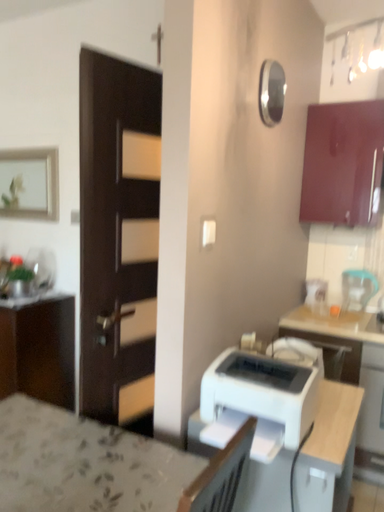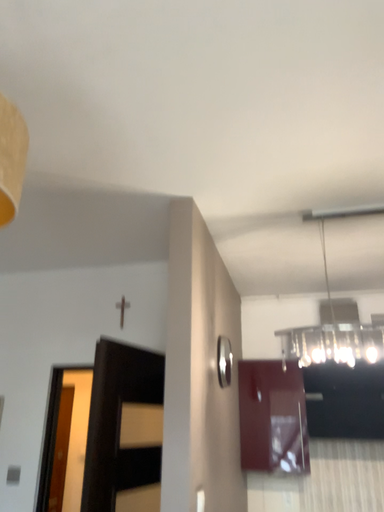
Question: Which way did the camera rotate in the video?

Choices:
 (A) rotated upward
 (B) rotated downward

Answer: (A)